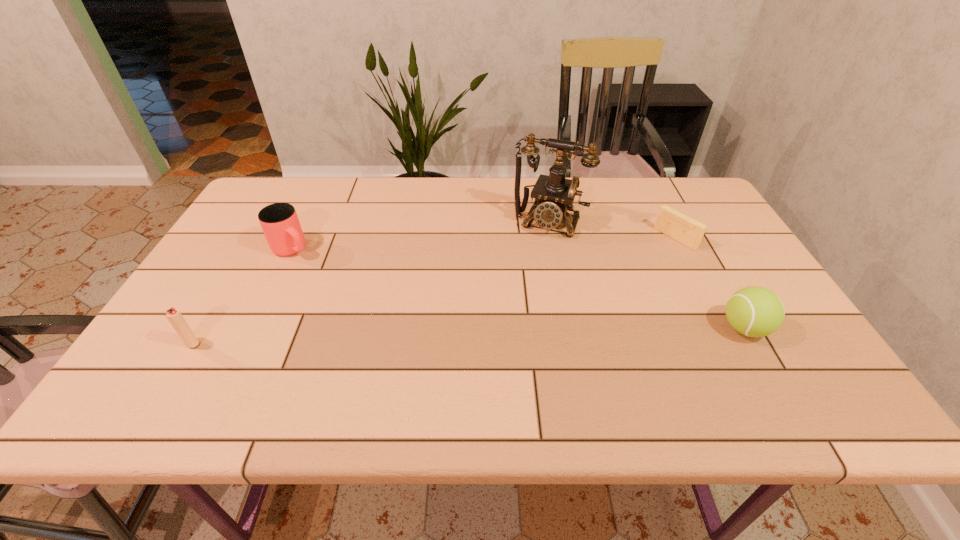
At what (x,y) coordinates should I click in order to perform the action: click on vacant area at the far right corner of the desktop. Please return your answer as a coordinate pair (x, y). The height and width of the screenshot is (540, 960). Looking at the image, I should click on (687, 199).

You are a GUI agent. You are given a task and a screenshot of the screen. Output one action in this format:
    pyautogui.click(x=<x>, y=<y>)
    Task: Click on the vacant space at the near right corner of the desktop
    The image size is (960, 540).
    Given the screenshot: What is the action you would take?
    pyautogui.click(x=799, y=352)

This screenshot has height=540, width=960. In order to click on empty space that is in between the tennis ball and the shortest object in this screenshot , I will do `click(709, 283)`.

Where is `free space between the tennis ball and the leftmost object`? free space between the tennis ball and the leftmost object is located at coordinates pyautogui.click(x=468, y=336).

The width and height of the screenshot is (960, 540). In order to click on free space between the cup and the leftmost object in this screenshot , I will do `click(242, 296)`.

Locate an element on the screen. The image size is (960, 540). vacant area between the fourth object from right to left and the tallest object is located at coordinates (420, 236).

I want to click on free point between the videotape and the leftmost object, so coord(434,291).

Where is `free area in between the leftmost object and the cup`? The image size is (960, 540). free area in between the leftmost object and the cup is located at coordinates (242, 296).

This screenshot has width=960, height=540. In order to click on free space between the leftmost object and the telephone in this screenshot , I will do `click(371, 283)`.

The height and width of the screenshot is (540, 960). Find the location of `free space between the tennis ball and the cup`. free space between the tennis ball and the cup is located at coordinates (518, 289).